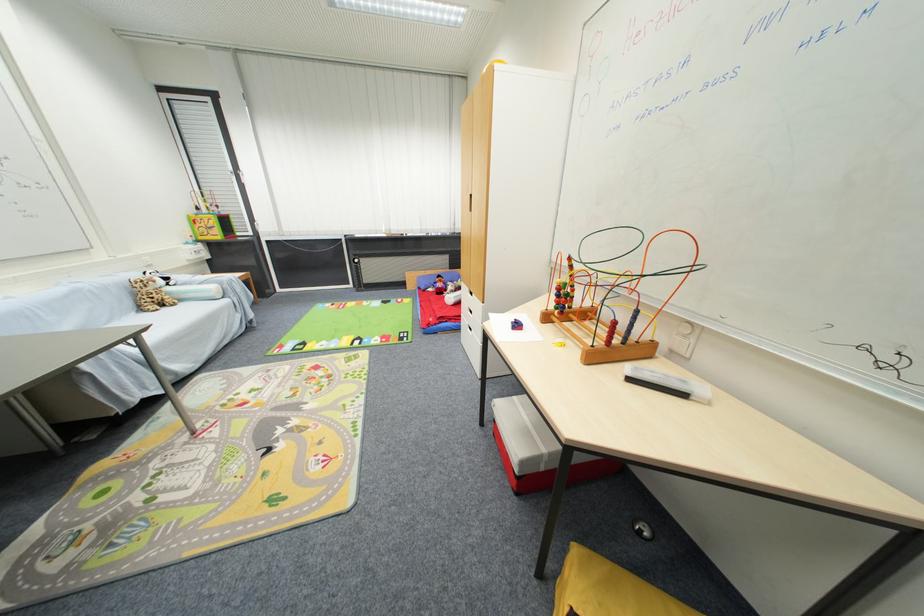
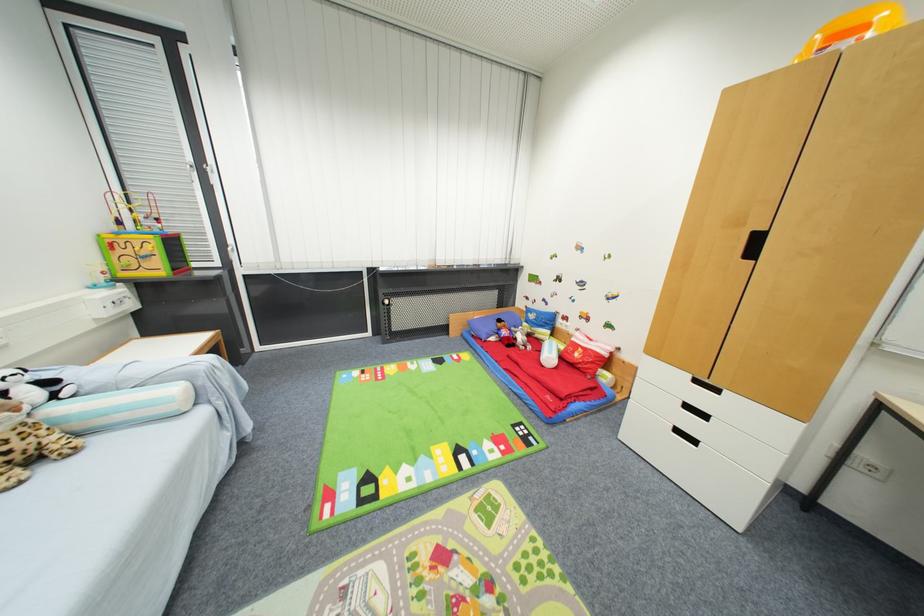
In the second image, find the point that corresponds to (x=171, y=281) in the first image.

(54, 384)